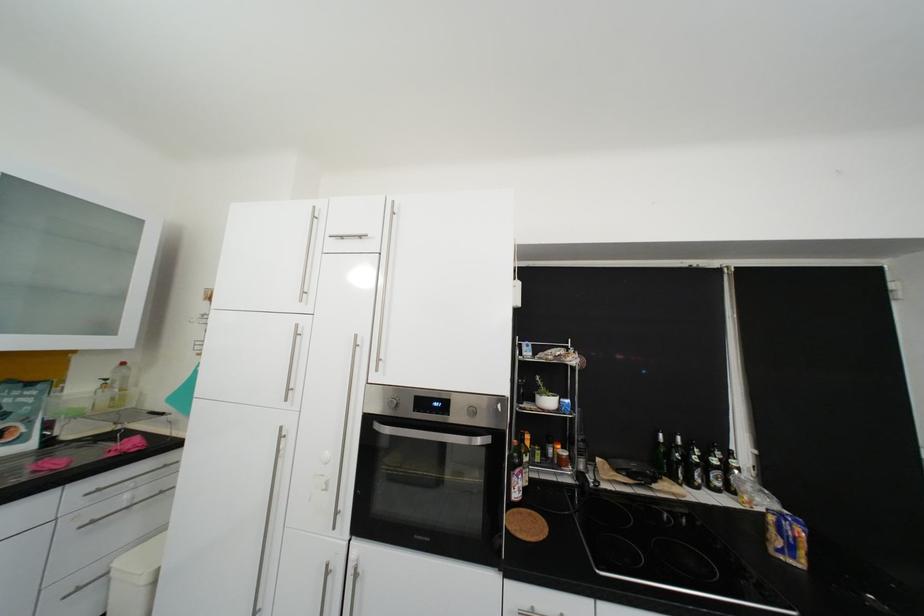
Where would you pull the white pull chain? Please return your answer as a coordinate pair (x, y).

(739, 383)